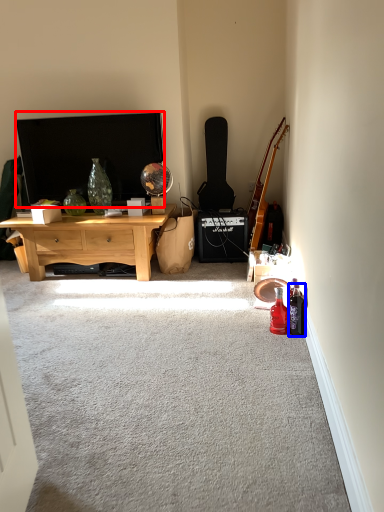
Question: Which object appears farthest to the camera in this image, television (highlighted by a red box) or bottle (highlighted by a blue box)?

Choices:
 (A) television
 (B) bottle

Answer: (A)